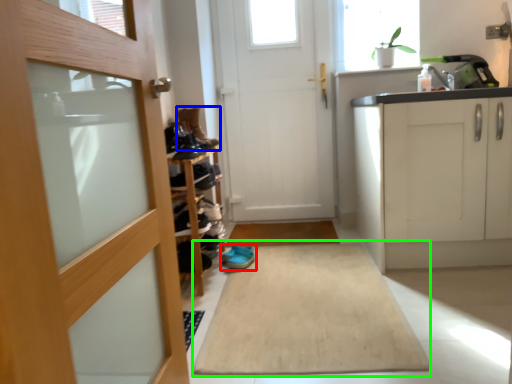
Question: Which object is positioned closest to footwear (highlighted by a red box)? Select from shoe (highlighted by a blue box) and bath mat (highlighted by a green box).

Choices:
 (A) shoe
 (B) bath mat

Answer: (B)